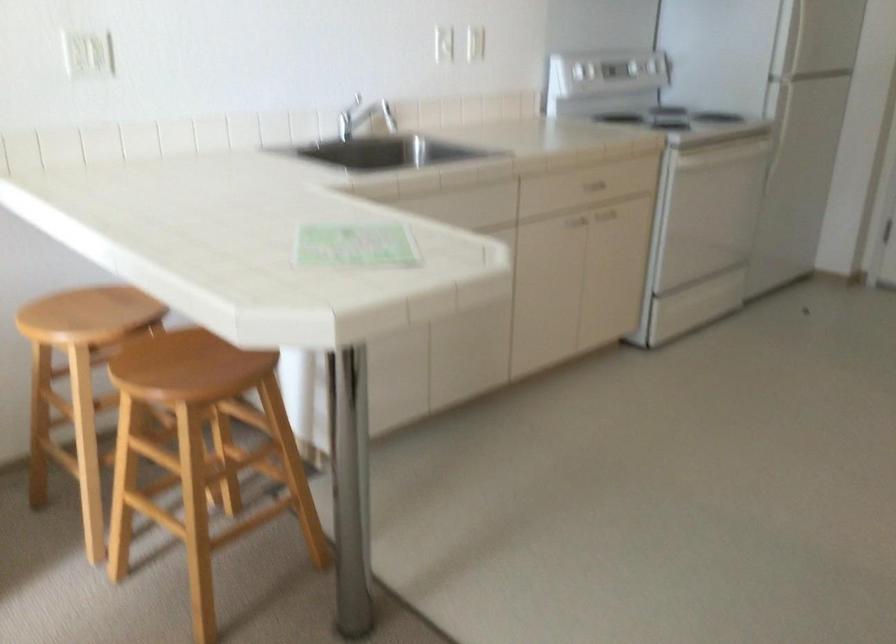
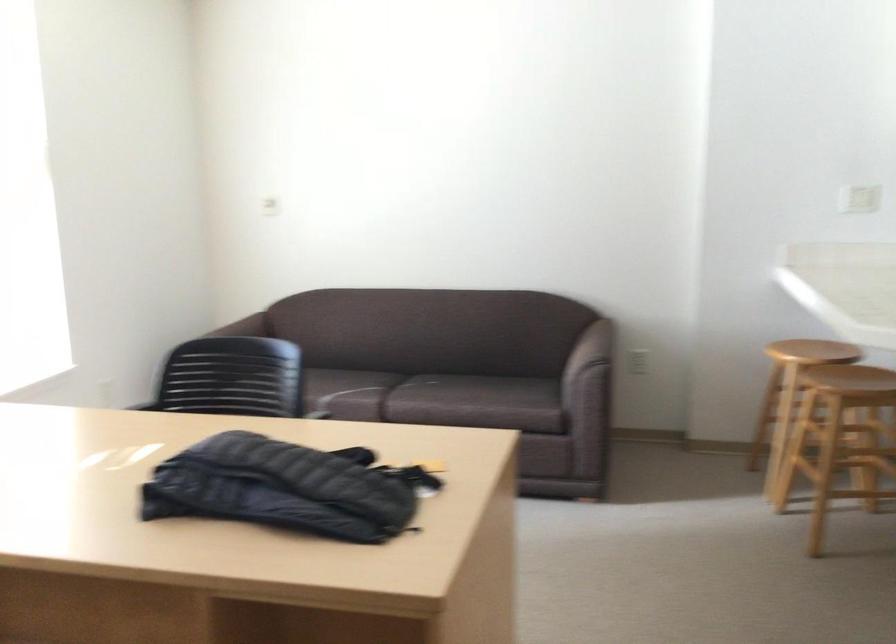
Locate, in the second image, the point that corresponds to (197,516) in the first image.

(837, 466)